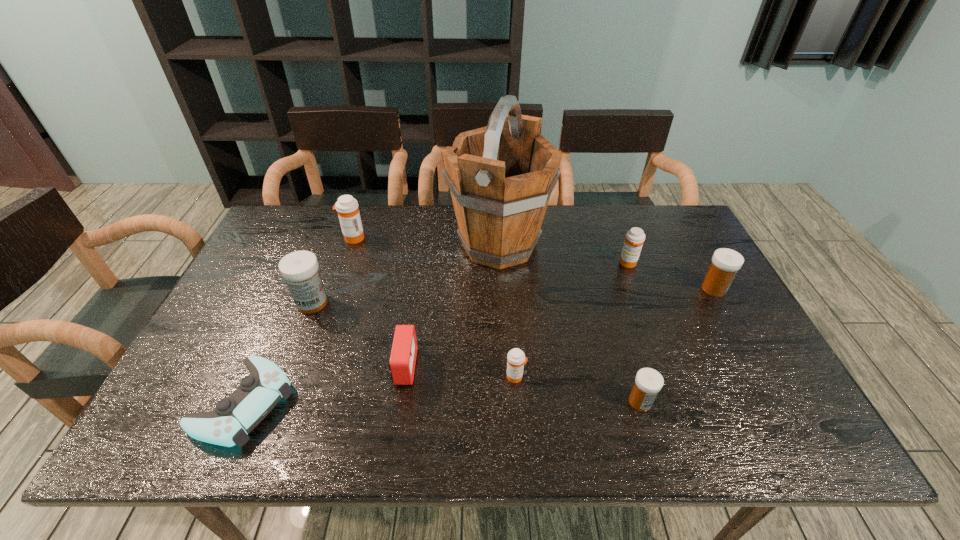
This screenshot has height=540, width=960. What are the coordinates of `bucket` in the screenshot? It's located at (501, 176).

Locate an element on the screen. The image size is (960, 540). the leftmost white medicine is located at coordinates (300, 269).

Identify the location of the farthest orange medicine. (347, 207).

Find the location of `the farthest medicine`. the farthest medicine is located at coordinates (347, 207).

This screenshot has width=960, height=540. I want to click on the rightmost medicine, so click(x=726, y=262).

Identify the location of the rightmost white medicine. This screenshot has width=960, height=540. (726, 262).

Locate an element on the screen. the fifth nearest medicine is located at coordinates (x=635, y=237).

Locate an element on the screen. The height and width of the screenshot is (540, 960). the second biggest orange medicine is located at coordinates (635, 237).

Locate an element on the screen. This screenshot has height=540, width=960. alarm clock is located at coordinates (402, 360).

This screenshot has width=960, height=540. Identify the location of red alarm clock. (402, 360).